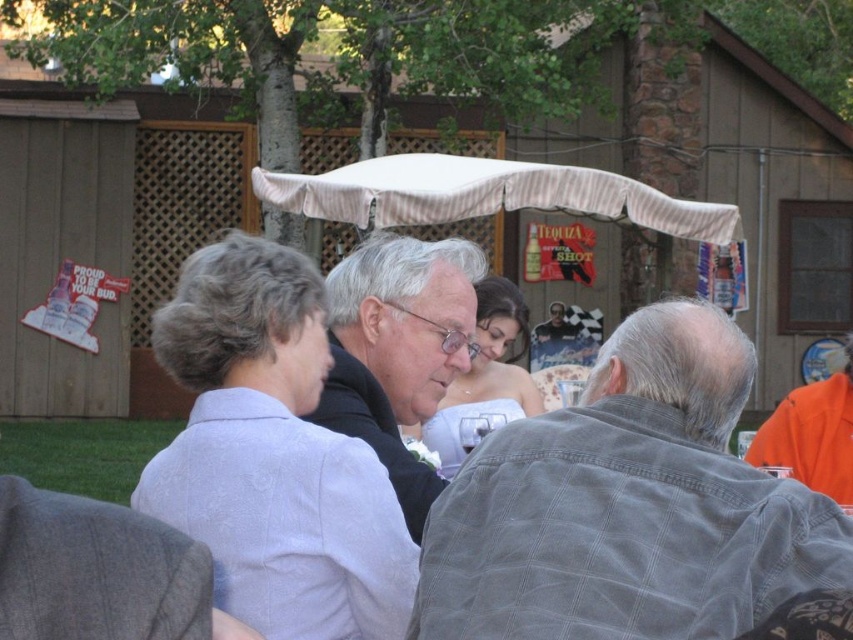
You are standing at the origin point of the image coordinate system. You want to find the gray corduroy jacket at center. In which direction should you look to locate it?

The gray corduroy jacket at center is located at point 0.791 on the x axis and 0.737 on the y axis. Since the coordinate system starts at the bottom left corner, you should look to the upper right direction to find it.

You are a photographer at the event and need to position yourself so that both the black textured suit at center and the white striped canopy at center are in your shot. Given that your camera has a maximum focal length that allows capturing objects up to 5 meters apart in the frame, will you be able to include both in a single photo?

The black textured suit at center and white striped canopy at center are 5.65 meters apart from each other. Since the maximum focal length allows capturing objects up to 5 meters apart, the distance between them exceeds this limit. Therefore, you cannot include both in a single photo.

Consider the image. You are at the wedding reception and need to locate the gray corduroy jacket at center and the black textured suit at center. According to the scene, which one is positioned to the right?

The gray corduroy jacket at center is to the right of the black textured suit at center.